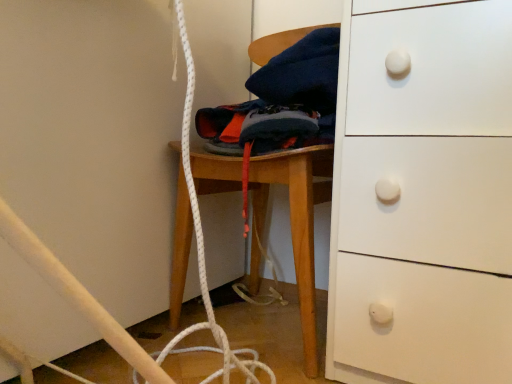
Where is `white textured battle rope at center`? white textured battle rope at center is located at coordinates (204, 252).

The image size is (512, 384). What do you see at coordinates (204, 252) in the screenshot? I see `white textured battle rope at center` at bounding box center [204, 252].

This screenshot has width=512, height=384. In order to click on white textured battle rope at center in this screenshot , I will do `click(204, 252)`.